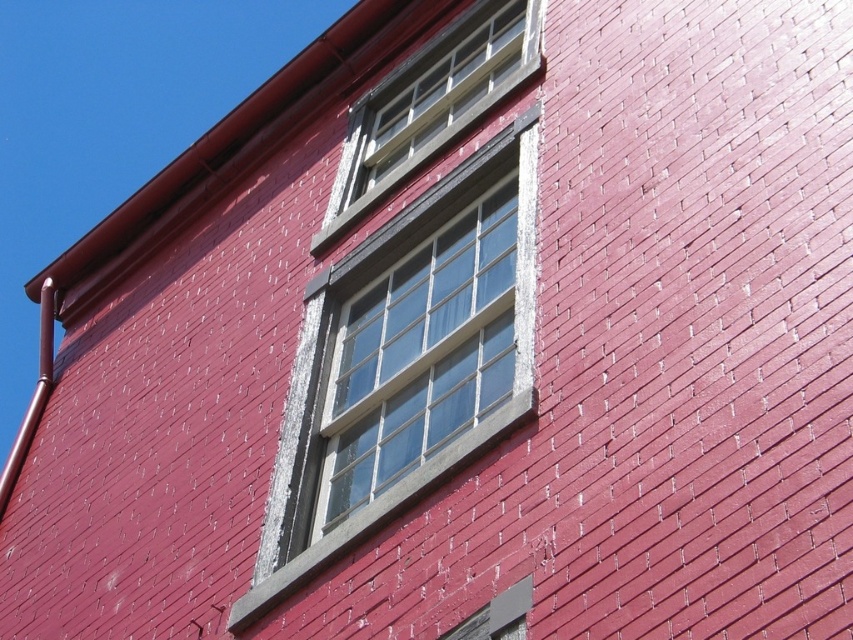
You are standing in front of a building with a red exterior wall. There are two windows with dark gray trim. The upper window is open and the lower one is closed. A point labeled as point (415, 342) is marked on the image. Which window does this point correspond to?

The point (415, 342) marks the clear glass window at center, which is the upper window that is partially open.

You are standing in front of a red brick wall with two windows. You notice two points marked on the wall at coordinates point [512,216] and point [438,116]. Which point is closer to you?

Point [512,216] is closer to the viewer than point [438,116].

From the picture: You need to hang a decorative banner that is 1.5 meters wide. You have two options on the wall, the clear glass window at center and the clear glass window at upper center. Which window can accommodate the banner without overlapping the edges?

The clear glass window at upper center has a greater width than the clear glass window at center. Since the banner is 1.5 meters wide, the clear glass window at upper center is the better option as it can accommodate the banner without overlapping the edges.